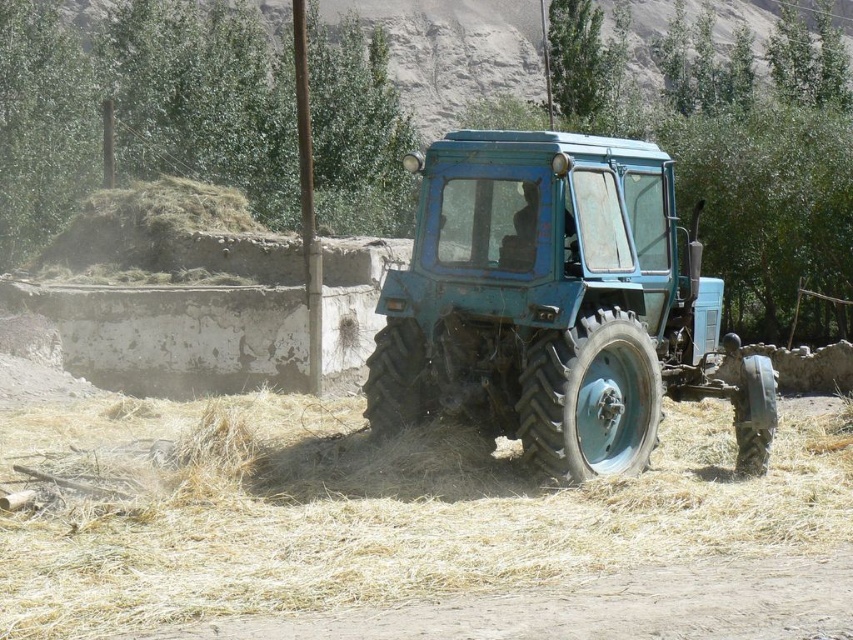
You are standing in the rural scene with the blue tractor. There are two points marked in the image. The first point is at coordinates point (416, 307) and the second point is at point (583, 584). Which point is closer to you?

Point (416, 307) is further to the camera than point (583, 584), so the second point is closer to you.